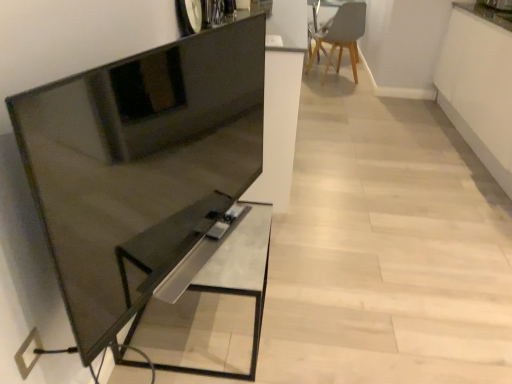
Question: From the image's perspective, would you say matte gray chair at upper right is positioned over metallic silver table at center?

Choices:
 (A) yes
 (B) no

Answer: (A)

Question: Is matte gray chair at upper right aimed at metallic silver table at center?

Choices:
 (A) yes
 (B) no

Answer: (B)

Question: Considering the relative sizes of matte gray chair at upper right and metallic silver table at center in the image provided, is matte gray chair at upper right smaller than metallic silver table at center?

Choices:
 (A) yes
 (B) no

Answer: (B)

Question: Is matte gray chair at upper right turned away from metallic silver table at center?

Choices:
 (A) no
 (B) yes

Answer: (A)

Question: From a real-world perspective, is matte gray chair at upper right on top of metallic silver table at center?

Choices:
 (A) yes
 (B) no

Answer: (A)

Question: Relative to metallic silver table at center, is matte black tv stand at left in front or behind?

Choices:
 (A) front
 (B) behind

Answer: (A)

Question: Does point (199, 185) appear closer or farther from the camera than point (192, 304)?

Choices:
 (A) farther
 (B) closer

Answer: (B)

Question: From the image's perspective, relative to metallic silver table at center, is matte black tv stand at left above or below?

Choices:
 (A) above
 (B) below

Answer: (A)

Question: Considering the positions of matte black tv stand at left and metallic silver table at center in the image, is matte black tv stand at left taller or shorter than metallic silver table at center?

Choices:
 (A) tall
 (B) short

Answer: (A)

Question: Does point (154, 52) appear closer or farther from the camera than point (345, 29)?

Choices:
 (A) closer
 (B) farther

Answer: (A)

Question: From a real-world perspective, relative to matte gray chair at upper right, is matte black tv stand at left vertically above or below?

Choices:
 (A) below
 (B) above

Answer: (B)

Question: Is matte black tv stand at left to the left or to the right of matte gray chair at upper right in the image?

Choices:
 (A) left
 (B) right

Answer: (A)

Question: From the image's perspective, is matte black tv stand at left located above or below matte gray chair at upper right?

Choices:
 (A) above
 (B) below

Answer: (B)

Question: Is matte gray chair at upper right to the left or to the right of metallic silver table at center in the image?

Choices:
 (A) left
 (B) right

Answer: (B)

Question: Would you say matte gray chair at upper right is inside or outside metallic silver table at center?

Choices:
 (A) inside
 (B) outside

Answer: (B)